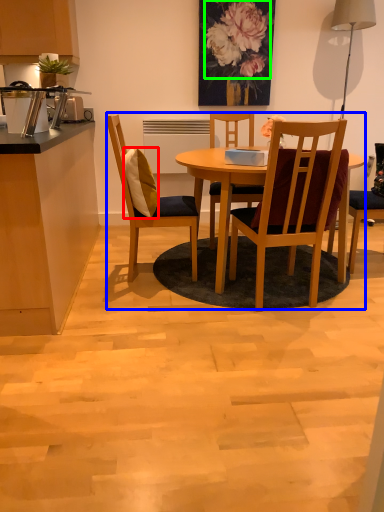
Question: Estimate the real-world distances between objects in this image. Which object is closer to pillow (highlighted by a red box), kitchen & dining room table (highlighted by a blue box) or flower (highlighted by a green box)?

Choices:
 (A) kitchen & dining room table
 (B) flower

Answer: (A)